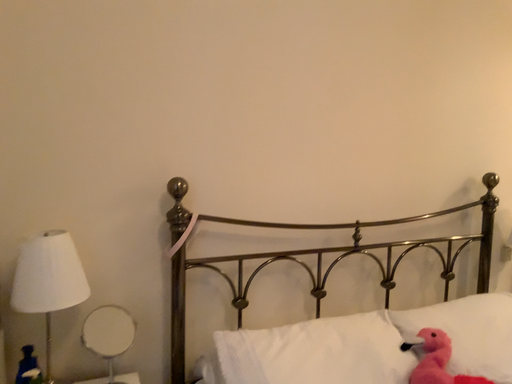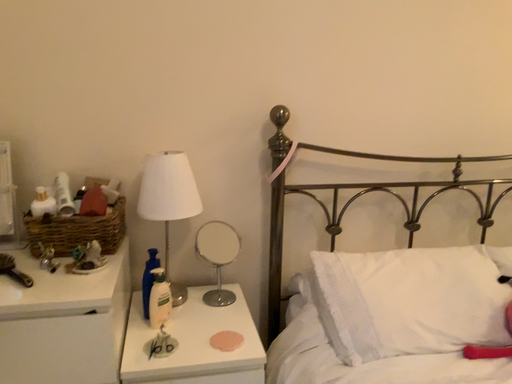
Question: Which way did the camera rotate in the video?

Choices:
 (A) rotated right
 (B) rotated left

Answer: (B)